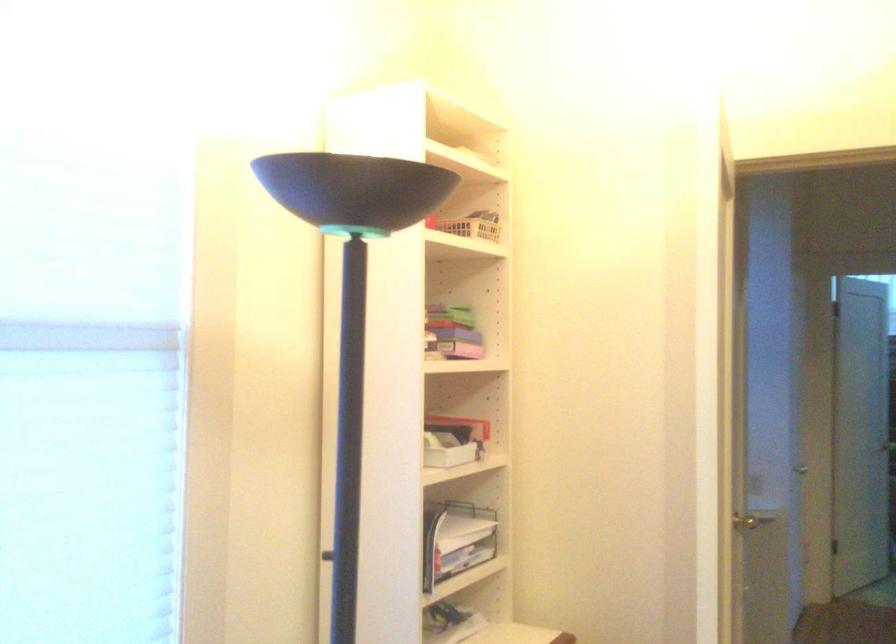
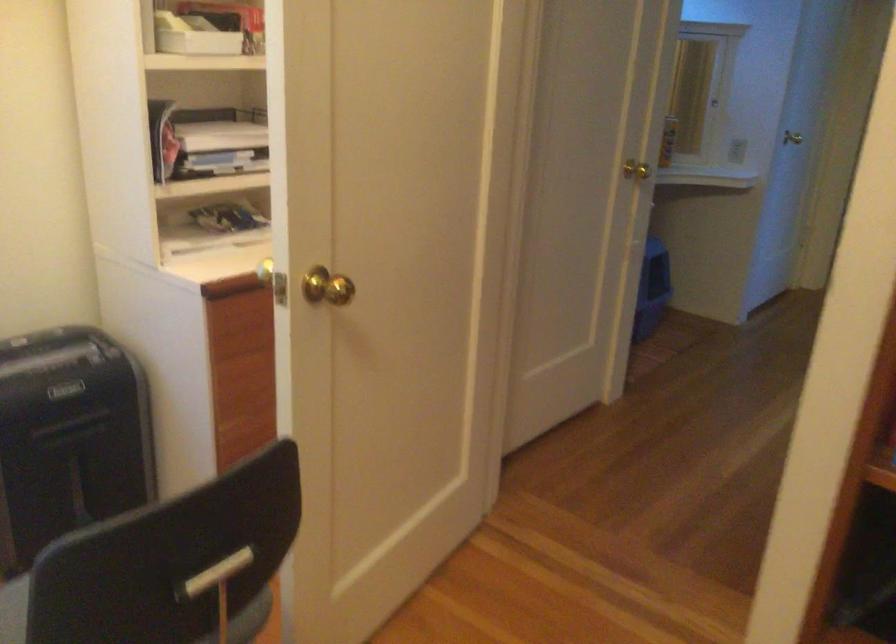
Question: How did the camera likely rotate?

Choices:
 (A) Left
 (B) Right
 (C) Up
 (D) Down

Answer: (D)